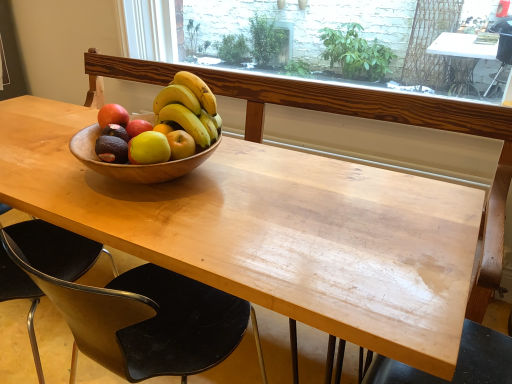
Question: From a real-world perspective, is black plastic chair at lower left, placed as the third chair when sorted from right to left, located higher than wooden table at center?

Choices:
 (A) yes
 (B) no

Answer: (A)

Question: Can you confirm if black plastic chair at lower left, the 1th chair positioned from the left, is taller than wooden table at center?

Choices:
 (A) no
 (B) yes

Answer: (A)

Question: Can you confirm if black plastic chair at lower left, placed as the third chair when sorted from right to left, is smaller than wooden table at center?

Choices:
 (A) no
 (B) yes

Answer: (B)

Question: Is black plastic chair at lower left, placed as the third chair when sorted from right to left, bigger than wooden table at center?

Choices:
 (A) yes
 (B) no

Answer: (B)

Question: Is black plastic chair at lower left, placed as the third chair when sorted from right to left, at the left side of wooden table at center?

Choices:
 (A) yes
 (B) no

Answer: (A)

Question: Is black plastic chair at lower left, placed as the third chair when sorted from right to left, behind wooden table at center?

Choices:
 (A) no
 (B) yes

Answer: (B)

Question: Is black plastic chair at lower right, which is the 1th chair from right to left, surrounded by green matte grapefruit at center?

Choices:
 (A) no
 (B) yes

Answer: (A)

Question: Is green matte grapefruit at center at the left side of black plastic chair at lower right, which is the 1th chair from right to left?

Choices:
 (A) no
 (B) yes

Answer: (B)

Question: Considering the relative sizes of green matte grapefruit at center and black plastic chair at lower right, which is the 1th chair from right to left, in the image provided, is green matte grapefruit at center smaller than black plastic chair at lower right, which is the 1th chair from right to left,?

Choices:
 (A) no
 (B) yes

Answer: (B)

Question: Considering the relative sizes of green matte grapefruit at center and black plastic chair at lower right, the third chair positioned from the left, in the image provided, is green matte grapefruit at center bigger than black plastic chair at lower right, the third chair positioned from the left,?

Choices:
 (A) yes
 (B) no

Answer: (B)

Question: Is the position of green matte grapefruit at center less distant than that of black plastic chair at lower right, which is the 1th chair from right to left?

Choices:
 (A) yes
 (B) no

Answer: (B)

Question: Considering the relative sizes of green matte grapefruit at center and black plastic chair at lower right, which is the 1th chair from right to left, in the image provided, is green matte grapefruit at center thinner than black plastic chair at lower right, which is the 1th chair from right to left,?

Choices:
 (A) yes
 (B) no

Answer: (A)

Question: From the image's perspective, is matte brown avocado at center beneath black plastic chair at lower right, which is the 1th chair from right to left?

Choices:
 (A) yes
 (B) no

Answer: (B)